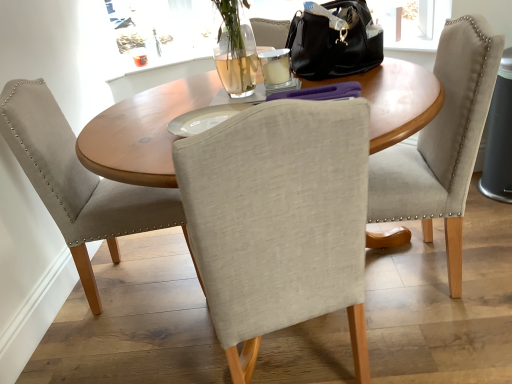
This screenshot has width=512, height=384. Find the location of `vacant space underneath wooden table at center (from a real-world perspective)`. vacant space underneath wooden table at center (from a real-world perspective) is located at coordinates (304, 354).